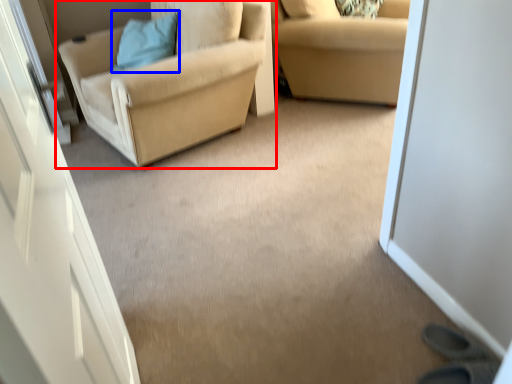
Question: Which of the following is the farthest to the observer, chair (highlighted by a red box) or pillow (highlighted by a blue box)?

Choices:
 (A) chair
 (B) pillow

Answer: (B)